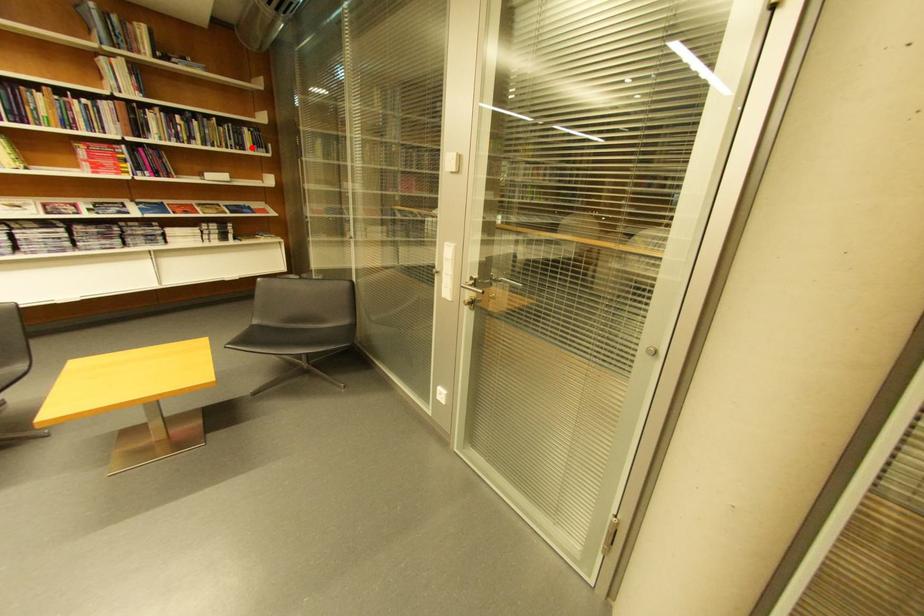
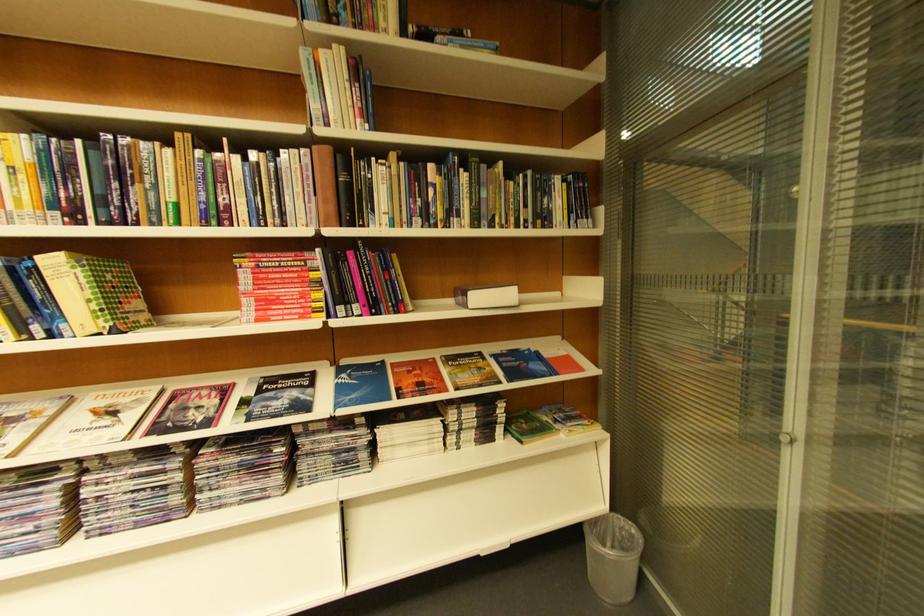
Where in the second image is the point corresponding to the highlighted location from the first image?

(554, 221)